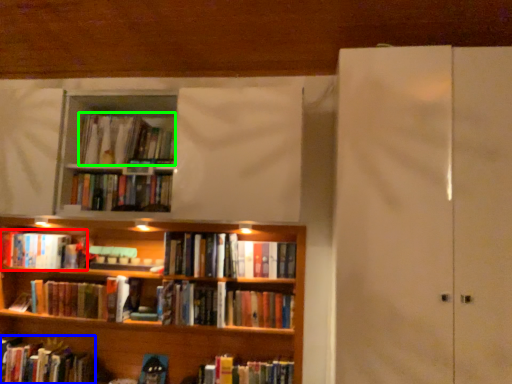
Question: Which object is the closest to the book (highlighted by a red box)? Choose among these: book (highlighted by a blue box) or book (highlighted by a green box).

Choices:
 (A) book
 (B) book

Answer: (A)